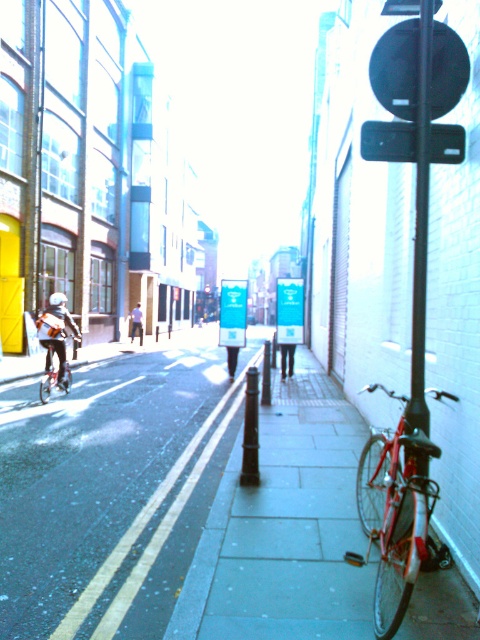
Question: Can you confirm if matte black helmet at upper left is positioned above light blue shirt at center?

Choices:
 (A) yes
 (B) no

Answer: (B)

Question: Which point appears farthest from the camera in this image?

Choices:
 (A) (70, 385)
 (B) (389, 474)

Answer: (A)

Question: Is black plastic at upper right smaller than shiny metallic bicycle at left?

Choices:
 (A) no
 (B) yes

Answer: (B)

Question: Among these objects, which one is nearest to the camera?

Choices:
 (A) shiny metallic bicycle at left
 (B) shiny red bicycle at right

Answer: (B)

Question: Which point is closer to the camera taking this photo?

Choices:
 (A) (440, 141)
 (B) (321, 577)
 (C) (66, 385)

Answer: (A)

Question: Does black plastic at upper right appear under matte black helmet at upper left?

Choices:
 (A) yes
 (B) no

Answer: (B)